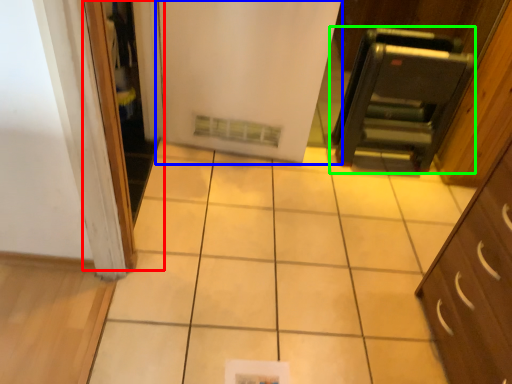
Question: Which is nearer to the screen door (highlighted by a red box)? door (highlighted by a blue box) or appliance (highlighted by a green box).

Choices:
 (A) door
 (B) appliance

Answer: (A)